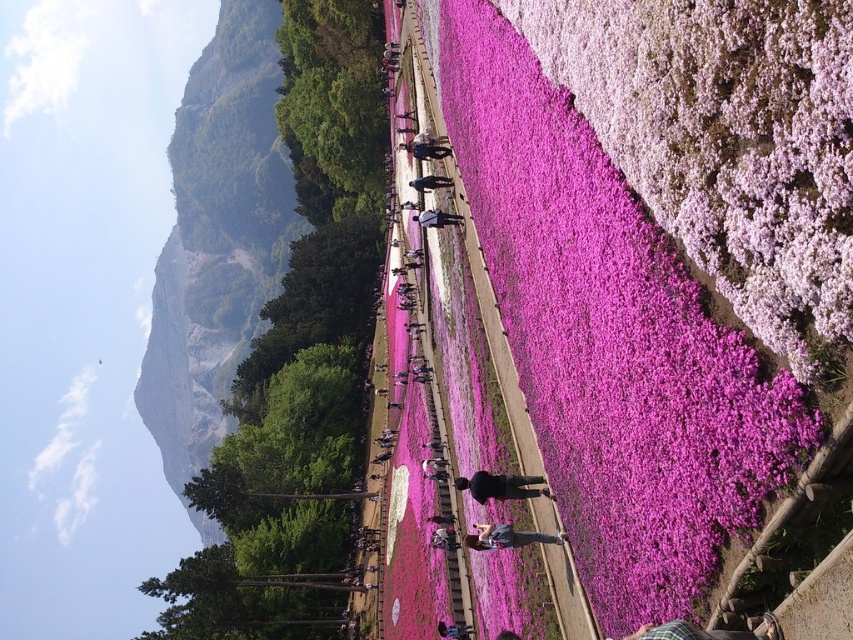
Is pink fluffy petals at center above green leafy hillside at upper left?

No, pink fluffy petals at center is not above green leafy hillside at upper left.

Which of these two, pink fluffy petals at center or green leafy hillside at upper left, stands taller?

green leafy hillside at upper left

Is point (561, 323) positioned in front of point (178, 160)?

Yes, it is.

Where is `pink fluffy petals at center`? pink fluffy petals at center is located at coordinates (608, 324).